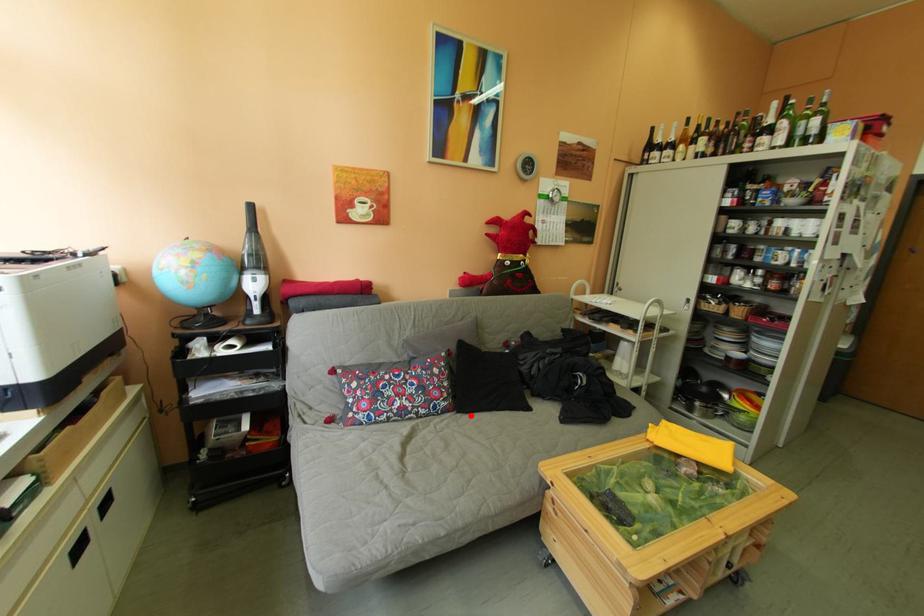
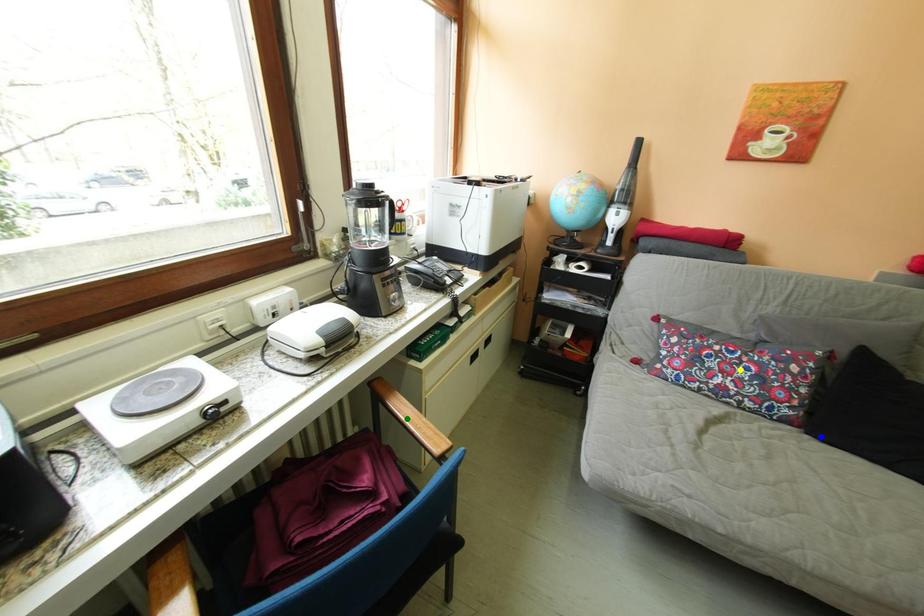
Question: I am providing you with two images of the same scene from different viewpoints. A red point is marked on the first image. You are given multiple points on the second image. Can you choose the point in image 2 that corresponds to the point in image 1?

Choices:
 (A) yellow point
 (B) green point
 (C) blue point

Answer: (C)